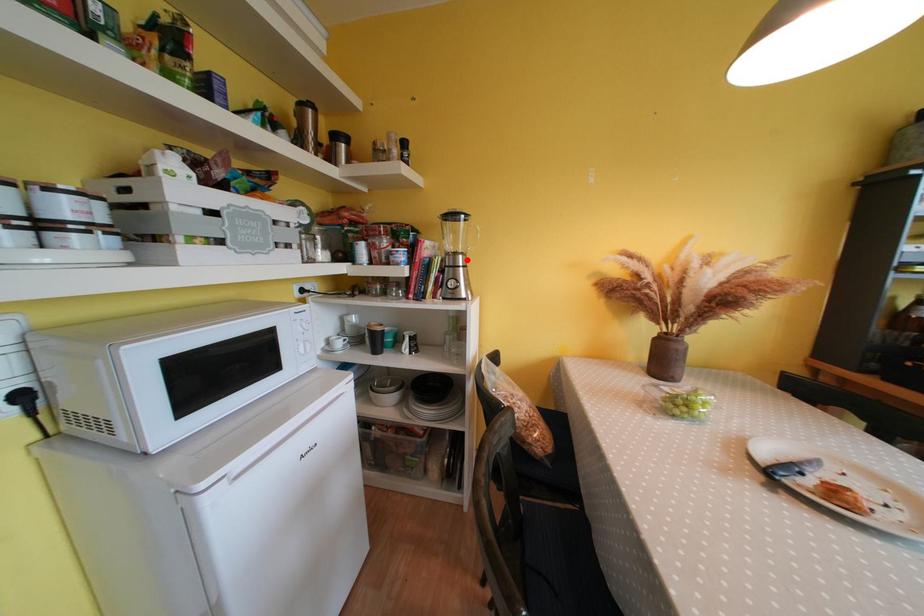
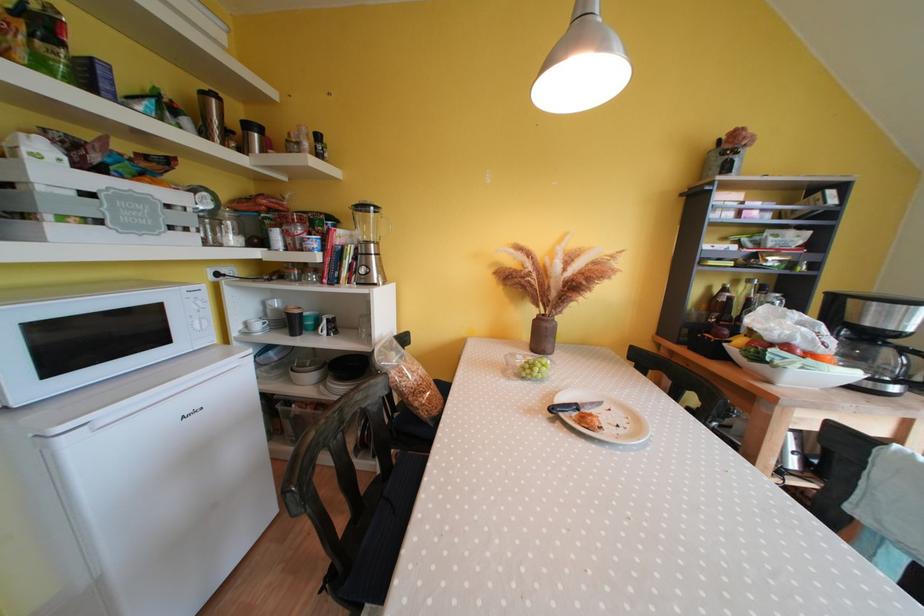
Question: I am providing you with two images of the same scene from different viewpoints. A red point is marked on the first image. Can you still see the location of the red point in image 2?

Choices:
 (A) Yes
 (B) No

Answer: (A)